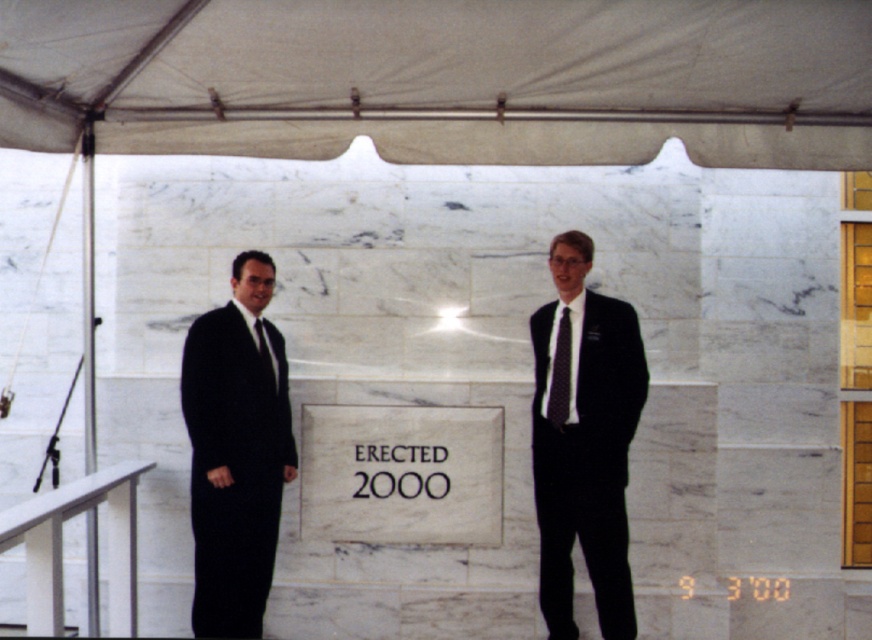
You are a photographer at a formal event. You need to ensure that the white fabric canopy at upper center and the black satin suit at left are both visible in your photo. Given their sizes, which object should you focus on to ensure both fit in the frame?

The white fabric canopy at upper center is bigger than the black satin suit at left, so you should focus on capturing the white fabric canopy at upper center first to ensure it fits, as it requires more space in the frame.

You are a photographer at a formal event. You need to adjust the lighting so that the white fabric canopy at upper center and the black silk tie at right are both well lit. Since the canopy is to the left of the tie, where should you place the main light source relative to the subjects?

The white fabric canopy at upper center is positioned on the left side of black silk tie at right. To ensure both are well lit, place the main light source to the left of the subjects so that it illuminates the canopy first, then the tie.

You are standing at the base of the marble wall under the tent. You see two points marked on the wall. The first point is at coordinate point (62, 145) and the second point is at coordinate point (291, 476). Which point is closer to you?

Point (62, 145) is in front of point (291, 476), so it is closer to you.